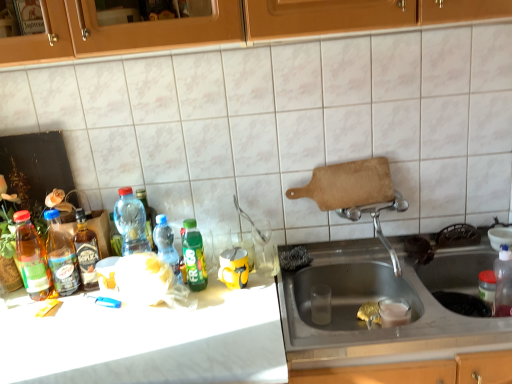
You are a GUI agent. You are given a task and a screenshot of the screen. Output one action in this format:
    pyautogui.click(x=<x>, y=<y>)
    Task: Click on the vacant space in front of translucent plastic bottle at left, the seventh bottle when ordered from right to left
    This screenshot has width=512, height=384.
    Given the screenshot: What is the action you would take?
    pyautogui.click(x=34, y=316)